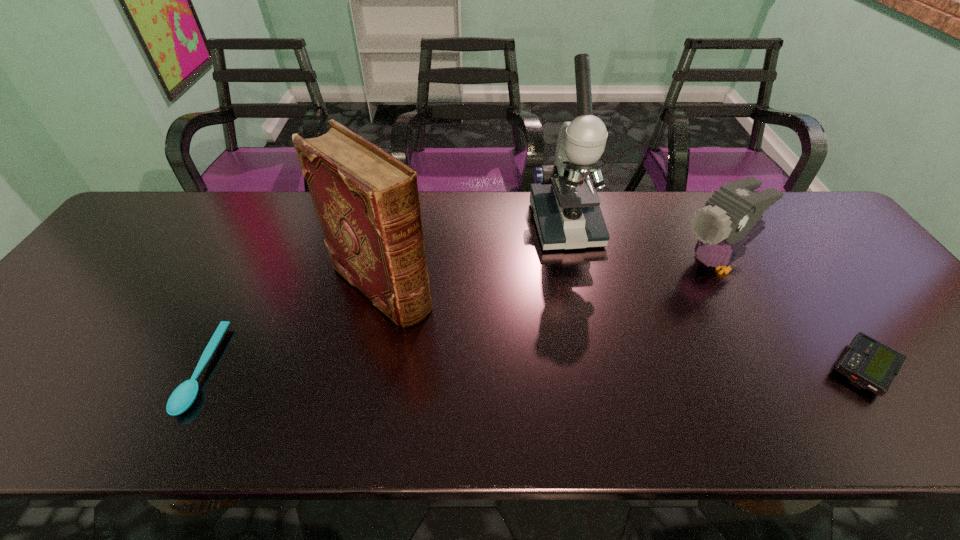
Find the location of `the shortest object`. the shortest object is located at coordinates (184, 395).

This screenshot has height=540, width=960. What are the coordinates of `the leftmost object` in the screenshot? It's located at (184, 395).

This screenshot has width=960, height=540. What are the coordinates of `the fourth tallest object` in the screenshot? It's located at (867, 363).

Locate an element on the screen. The image size is (960, 540). the rightmost object is located at coordinates (867, 363).

This screenshot has width=960, height=540. Identify the location of the fourth object from right to left. (367, 202).

This screenshot has height=540, width=960. Find the location of `the second tallest object`. the second tallest object is located at coordinates (367, 202).

The height and width of the screenshot is (540, 960). What are the coordinates of `the fourth object from left to right` in the screenshot? It's located at (734, 212).

Find the location of a particular element. The width and height of the screenshot is (960, 540). bird is located at coordinates coord(734,212).

Find the location of a particular element. Image resolution: width=960 pixels, height=540 pixels. microscope is located at coordinates (564, 201).

I want to click on vacant space located 0.350m on the left of the shortest object, so click(33, 369).